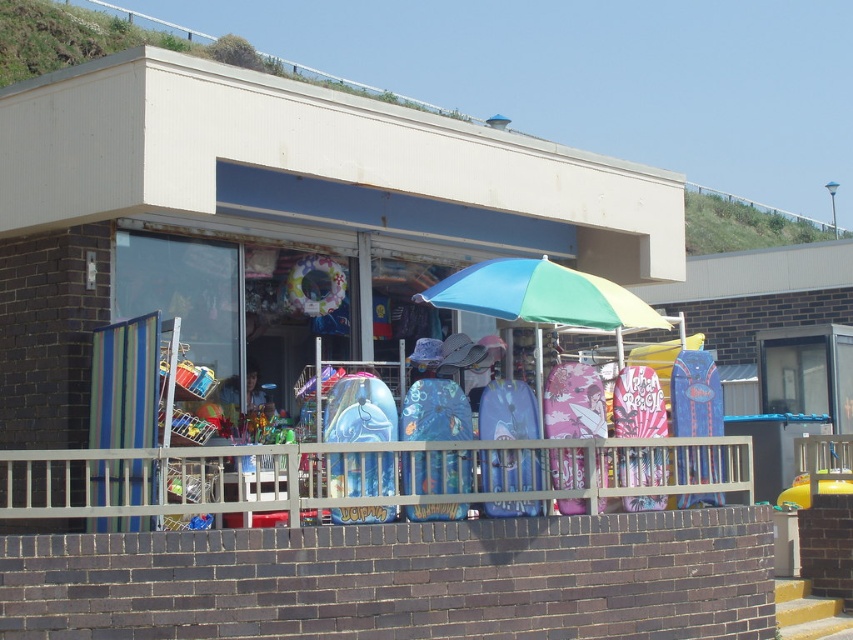
Can you confirm if matte plastic surfboards at center is bigger than blue-green striped umbrella at center?

No.

Who is taller, matte plastic surfboards at center or blue-green striped umbrella at center?

With more height is blue-green striped umbrella at center.

What do you see at coordinates (267, 218) in the screenshot?
I see `matte plastic surfboards at center` at bounding box center [267, 218].

Where is `matte plastic surfboards at center`? This screenshot has height=640, width=853. matte plastic surfboards at center is located at coordinates (267, 218).

Consider the image. Does metallic silver rail at center have a lesser height compared to blue-green striped umbrella at center?

In fact, metallic silver rail at center may be taller than blue-green striped umbrella at center.

Does metallic silver rail at center appear on the right side of blue-green striped umbrella at center?

Incorrect, metallic silver rail at center is not on the right side of blue-green striped umbrella at center.

Is point (583, 509) in front of point (527, 288)?

No, (583, 509) is further to viewer.

This screenshot has width=853, height=640. I want to click on metallic silver rail at center, so click(x=363, y=477).

Is blue-green striped umbrella at center below blue glossy surfboard at center?

Actually, blue-green striped umbrella at center is above blue glossy surfboard at center.

Can you confirm if blue-green striped umbrella at center is positioned above blue glossy surfboard at center?

Indeed, blue-green striped umbrella at center is positioned over blue glossy surfboard at center.

Image resolution: width=853 pixels, height=640 pixels. In order to click on blue-green striped umbrella at center in this screenshot , I will do `click(541, 296)`.

Locate an element on the screen. The image size is (853, 640). blue-green striped umbrella at center is located at coordinates (541, 296).